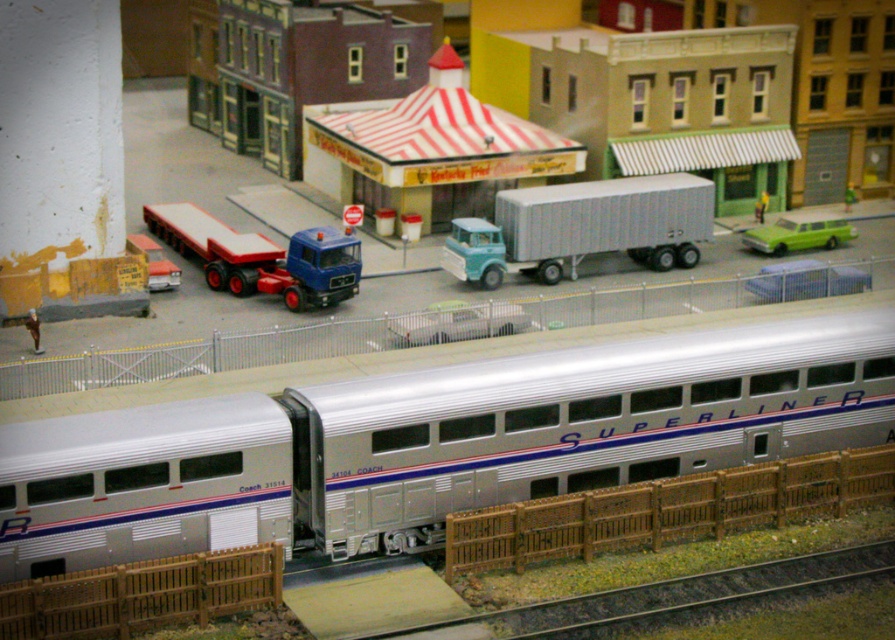
Which is in front, point (186, 246) or point (791, 236)?

Positioned in front is point (186, 246).

Which is above, metallic blue truck at center-left or green matte station wagon at center-right?

green matte station wagon at center-right is above.

Is point (331, 282) in front of point (831, 228)?

Yes, it is in front of point (831, 228).

Identify the location of metallic blue truck at center-left. (262, 257).

Does silver metallic train car at center have a lesser height compared to metallic silver car at center?

In fact, silver metallic train car at center may be taller than metallic silver car at center.

Which is in front, point (245, 452) or point (411, 340)?

Point (245, 452) is more forward.

Does point (586, 472) come in front of point (424, 332)?

Yes, it is in front of point (424, 332).

Identify the location of silver metallic train car at center. The image size is (895, 640). (430, 435).

What do you see at coordinates (262, 257) in the screenshot? I see `metallic blue truck at center-left` at bounding box center [262, 257].

Does metallic blue truck at center-left appear under metallic silver car at center?

No, metallic blue truck at center-left is not below metallic silver car at center.

This screenshot has height=640, width=895. What do you see at coordinates (262, 257) in the screenshot?
I see `metallic blue truck at center-left` at bounding box center [262, 257].

The image size is (895, 640). I want to click on metallic blue truck at center-left, so click(x=262, y=257).